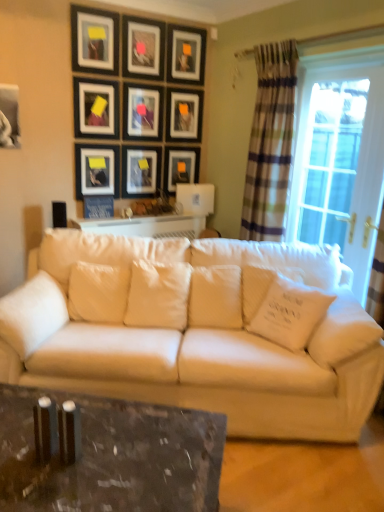
This screenshot has height=512, width=384. What are the coordinates of `vacant area on top of marble glass table at center (from a real-world perspective)` in the screenshot? It's located at (106, 447).